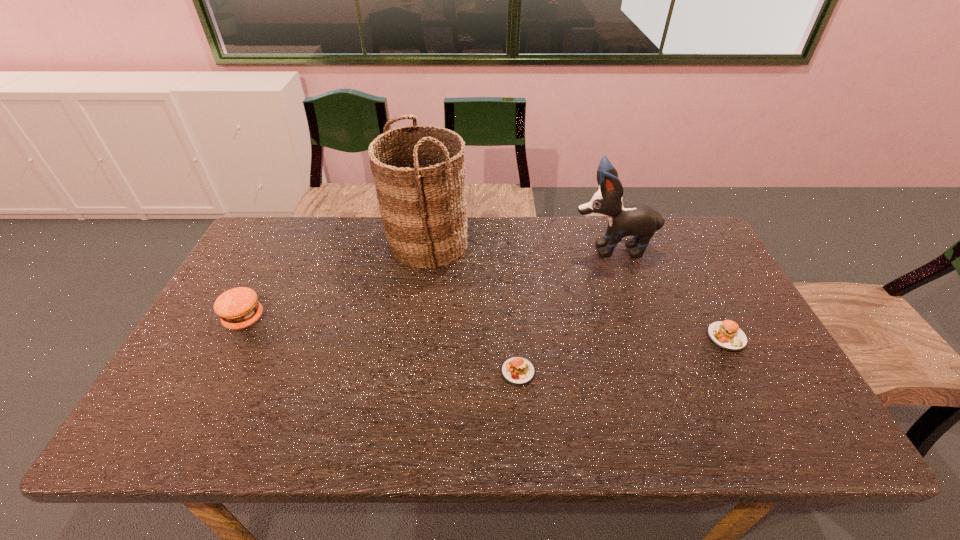
This screenshot has width=960, height=540. Identify the location of object at the right edge. (726, 334).

Where is `free space at the far edge of the desktop`? free space at the far edge of the desktop is located at coordinates (360, 231).

This screenshot has height=540, width=960. Identify the location of vacant space at the left edge of the desktop. 186,381.

At what (x,y) coordinates should I click in order to perform the action: click on free space at the right edge of the desktop. Please return your answer as a coordinate pair (x, y). Looking at the image, I should click on (738, 391).

I want to click on vacant area at the far left corner of the desktop, so click(x=291, y=221).

At what (x,y) coordinates should I click in order to perform the action: click on vacant area that lies between the shortest patty (food) and the fourth object from right to left. Please return your answer as a coordinate pair (x, y). This screenshot has height=540, width=960. Looking at the image, I should click on (472, 307).

The image size is (960, 540). What are the coordinates of `free spot between the tallest patty (food) and the second shortest object` in the screenshot? It's located at (486, 328).

Find the location of a particular element. The image size is (960, 540). vacant space that is in between the tallest object and the third object from right to left is located at coordinates (472, 307).

The width and height of the screenshot is (960, 540). I want to click on free spot between the third tallest object and the shortest object, so click(x=381, y=345).

The width and height of the screenshot is (960, 540). Identify the location of free space that is in between the tallest object and the tallest patty (food). (336, 281).